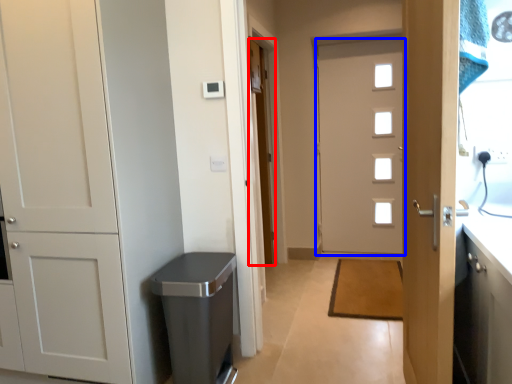
Question: Among these objects, which one is farthest to the camera, door (highlighted by a red box) or door (highlighted by a blue box)?

Choices:
 (A) door
 (B) door

Answer: (A)